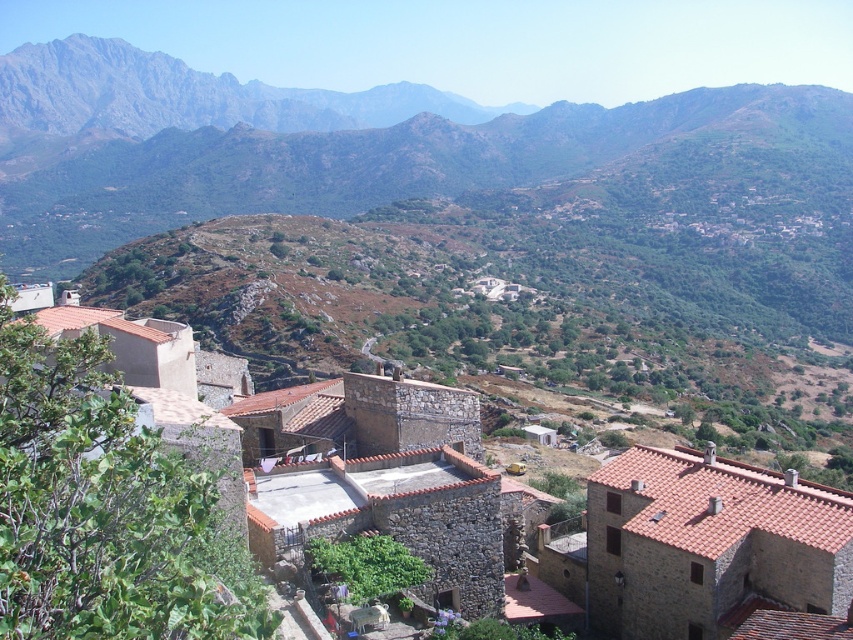
You are standing at the point labeled as point (x=444, y=227) in the image. Looking around, you see the green grassy hillside at center. What is directly beneath your feet?

The point labeled as point (x=444, y=227) corresponds to the green grassy hillside at center, so the green grassy hillside at center is directly beneath your feet.